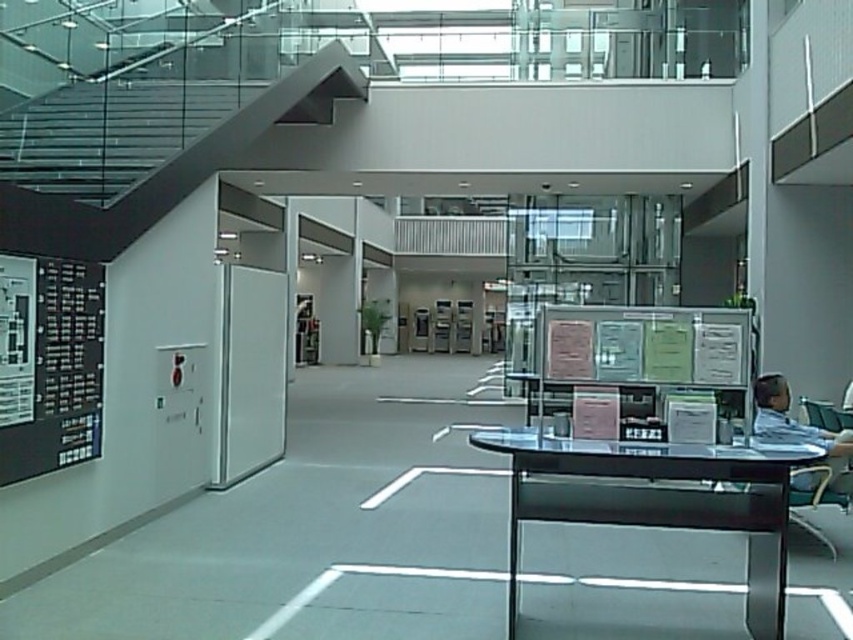
Between transparent glass table at center and metallic silver chair at lower right, which one has less height?

metallic silver chair at lower right

Between point (622, 451) and point (834, 492), which one is positioned behind?

Positioned behind is point (834, 492).

Who is more distant from viewer, (492, 429) or (838, 456)?

Positioned behind is point (838, 456).

The image size is (853, 640). I want to click on transparent glass table at center, so click(656, 500).

Does point (13, 404) lie behind point (799, 522)?

No, (13, 404) is closer to viewer.

Consider the image. Does black matte board at left have a lesser height compared to metallic silver chair at lower right?

No, black matte board at left is not shorter than metallic silver chair at lower right.

Is point (12, 483) farther from camera compared to point (830, 486)?

No, it is not.

The height and width of the screenshot is (640, 853). I want to click on black matte board at left, so click(x=49, y=364).

Measure the distance between transparent glass table at center and camera.

transparent glass table at center and camera are 4.07 meters apart.

Who is positioned more to the left, transparent glass table at center or light blue shirt at right?

transparent glass table at center

You are a GUI agent. You are given a task and a screenshot of the screen. Output one action in this format:
    pyautogui.click(x=<x>, y=<y>)
    Task: Click on the transparent glass table at center
    The image size is (853, 640).
    Given the screenshot: What is the action you would take?
    pyautogui.click(x=656, y=500)